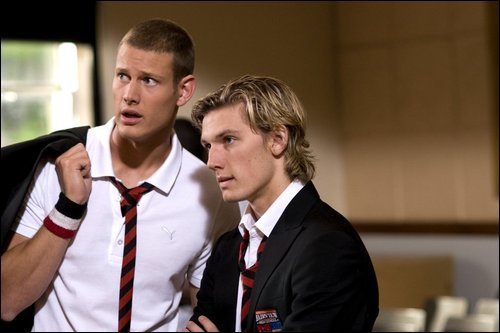
The image size is (500, 333). I want to click on window, so click(47, 93).